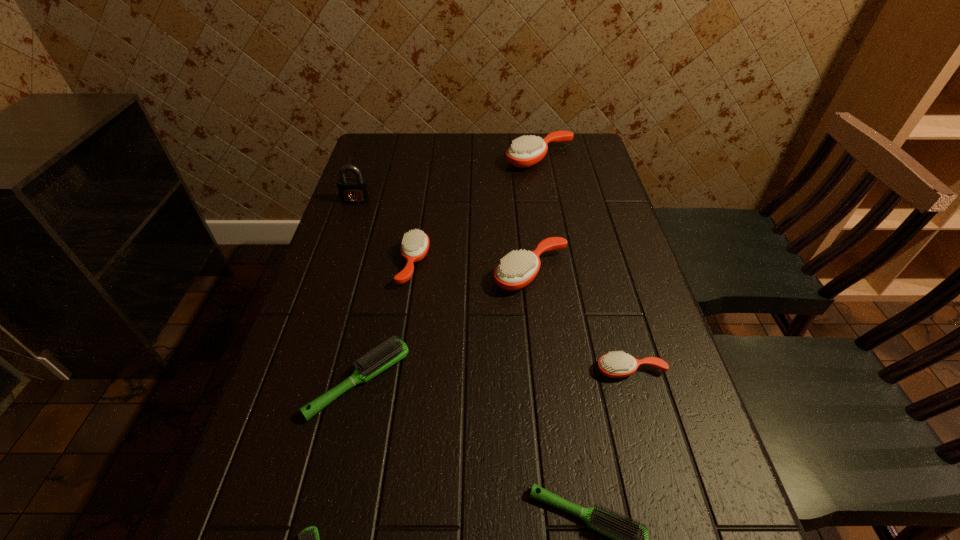
The height and width of the screenshot is (540, 960). What are the coordinates of `free space located on the front of the padlock near the keyhole` in the screenshot? It's located at click(319, 310).

At what (x,y) coordinates should I click in order to perform the action: click on vacant position located on the left of the second tallest object. Please return your answer as a coordinate pair (x, y). The image size is (960, 540). Looking at the image, I should click on (474, 158).

Identify the location of free space located 0.220m on the left of the second biggest orange hairbrush. (402, 272).

This screenshot has height=540, width=960. In order to click on vacant space situated on the back of the second smallest orange hairbrush in this screenshot , I will do `click(427, 181)`.

Locate an element on the screen. This screenshot has height=540, width=960. vacant space situated 0.130m on the back of the farthest light hairbrush is located at coordinates (377, 299).

Identify the location of vacant space situated 0.120m on the back of the nearest orange hairbrush. (614, 314).

This screenshot has height=540, width=960. I want to click on object that is at the far edge, so click(x=526, y=151).

Find the location of `padlock situated at the left edge`. padlock situated at the left edge is located at coordinates (355, 190).

Where is `hairbrush present at the left edge`? This screenshot has width=960, height=540. hairbrush present at the left edge is located at coordinates (375, 362).

You are a GUI agent. You are given a task and a screenshot of the screen. Output one action in this format:
    pyautogui.click(x=<x>, y=<y>)
    Task: Click on the object positioned at the far right corner
    
    Given the screenshot: What is the action you would take?
    pyautogui.click(x=526, y=151)